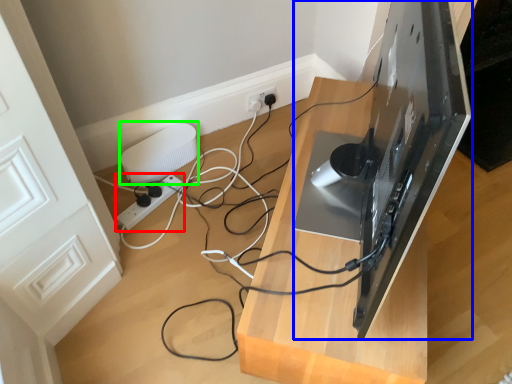
Question: Considering the real-world distances, which object is farthest from extension cord (highlighted by a red box)? desktop computer (highlighted by a blue box) or appliance (highlighted by a green box)?

Choices:
 (A) desktop computer
 (B) appliance

Answer: (A)